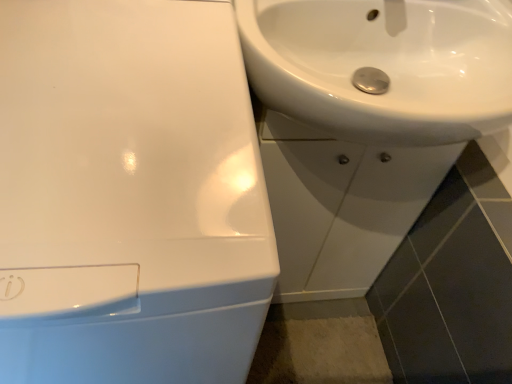
Question: Is white glossy sink at center, which ranks as the second sink in left-to-right order, a part of white glossy sink at upper right, acting as the third sink starting from the right?

Choices:
 (A) no
 (B) yes

Answer: (A)

Question: Is the position of white glossy sink at upper right, marked as the 1th sink in a left-to-right arrangement, less distant than that of white glossy sink at center, which appears as the 2th sink when viewed from the right?

Choices:
 (A) yes
 (B) no

Answer: (A)

Question: From a real-world perspective, is white glossy sink at upper right, marked as the 1th sink in a left-to-right arrangement, located higher than white glossy sink at center, which ranks as the second sink in left-to-right order?

Choices:
 (A) yes
 (B) no

Answer: (A)

Question: Are white glossy sink at upper right, marked as the 1th sink in a left-to-right arrangement, and white glossy sink at center, which appears as the 2th sink when viewed from the right, beside each other?

Choices:
 (A) no
 (B) yes

Answer: (A)

Question: Is white glossy sink at upper right, marked as the 1th sink in a left-to-right arrangement, facing towards white glossy sink at center, which ranks as the second sink in left-to-right order?

Choices:
 (A) no
 (B) yes

Answer: (A)

Question: In the image, is white glossy sink at upper right, which appears as the third sink when viewed from the left, positioned in front of or behind white glossy sink at upper right, acting as the third sink starting from the right?

Choices:
 (A) front
 (B) behind

Answer: (B)

Question: Would you say white glossy sink at upper right, which appears as the first sink when viewed from the right, is inside or outside white glossy sink at upper right, acting as the third sink starting from the right?

Choices:
 (A) outside
 (B) inside

Answer: (A)

Question: Is white glossy sink at upper right, which appears as the first sink when viewed from the right, to the left or to the right of white glossy sink at upper right, acting as the third sink starting from the right, in the image?

Choices:
 (A) left
 (B) right

Answer: (B)

Question: Is white glossy sink at upper right, which appears as the first sink when viewed from the right, taller or shorter than white glossy sink at upper right, acting as the third sink starting from the right?

Choices:
 (A) short
 (B) tall

Answer: (A)

Question: Is point (87, 354) positioned closer to the camera than point (353, 137)?

Choices:
 (A) closer
 (B) farther

Answer: (A)

Question: Based on their sizes in the image, would you say white glossy sink at upper right, acting as the third sink starting from the right, is bigger or smaller than white glossy sink at upper right, which appears as the first sink when viewed from the right?

Choices:
 (A) big
 (B) small

Answer: (A)

Question: Looking at their shapes, would you say white glossy sink at upper right, acting as the third sink starting from the right, is wider or thinner than white glossy sink at upper right, which appears as the third sink when viewed from the left?

Choices:
 (A) thin
 (B) wide

Answer: (B)

Question: Considering the positions of white glossy sink at upper right, acting as the third sink starting from the right, and white glossy sink at upper right, which appears as the third sink when viewed from the left, in the image, is white glossy sink at upper right, acting as the third sink starting from the right, taller or shorter than white glossy sink at upper right, which appears as the third sink when viewed from the left,?

Choices:
 (A) short
 (B) tall

Answer: (B)

Question: Is white glossy sink at center, which ranks as the second sink in left-to-right order, to the left or to the right of white glossy sink at upper right, which appears as the third sink when viewed from the left, in the image?

Choices:
 (A) left
 (B) right

Answer: (A)

Question: From the image's perspective, is white glossy sink at center, which ranks as the second sink in left-to-right order, located above or below white glossy sink at upper right, which appears as the third sink when viewed from the left?

Choices:
 (A) above
 (B) below

Answer: (B)